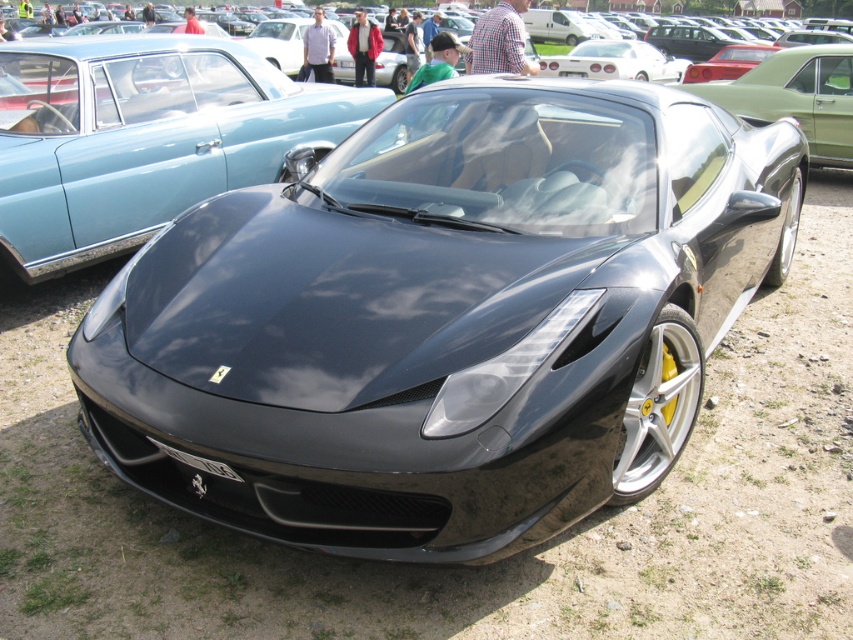
You are standing at the point closest to the Ferrari sports car. Which of the two points, point (132,179) or point (238,476), is farther away from you?

Point (132,179) is behind point (238,476), so it is farther away from you.